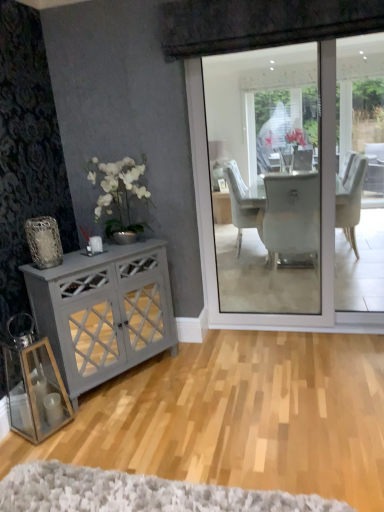
Locate an element on the screen. The width and height of the screenshot is (384, 512). unoccupied area in front of matte gray cabinet at left is located at coordinates (123, 426).